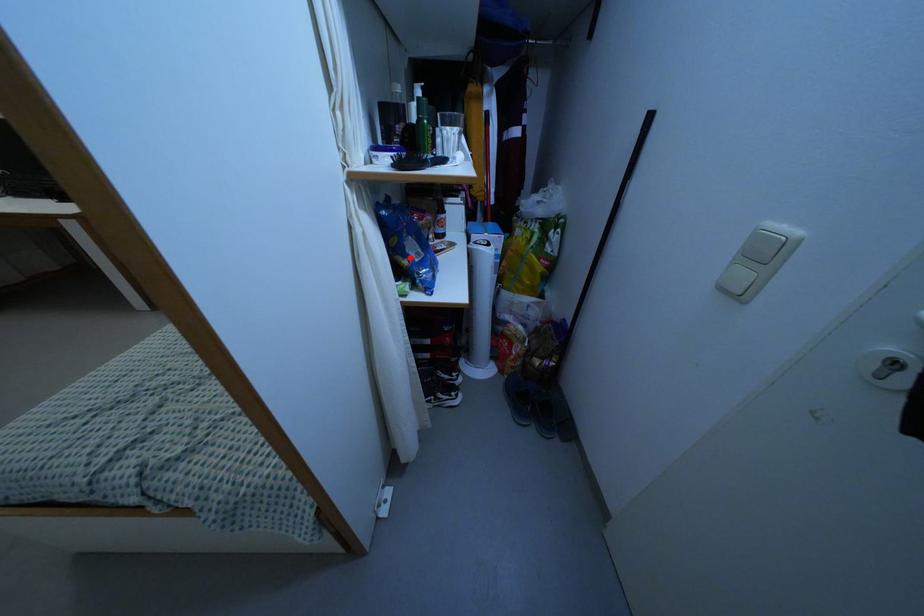
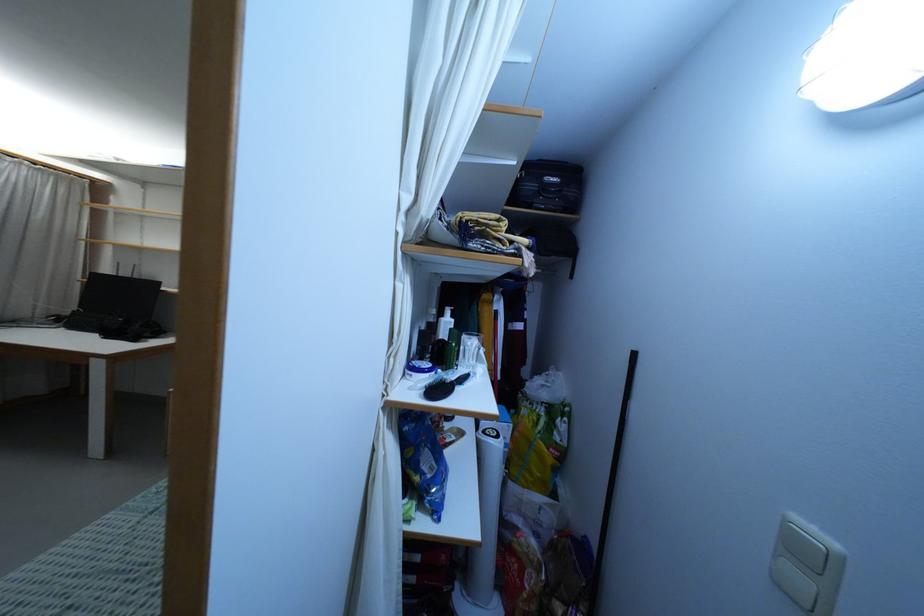
Question: I am providing you with two images of the same scene from different viewpoints. In image1, a red point is highlighted. Considering the same 3D point in image2, which of the following is correct?

Choices:
 (A) It is closer
 (B) It is farther

Answer: (B)